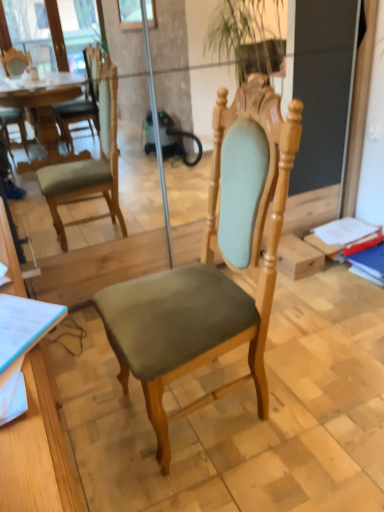
I want to click on wooden desk at lower left, so click(36, 451).

What do you see at coordinates (36, 451) in the screenshot?
I see `wooden desk at lower left` at bounding box center [36, 451].

Describe the element at coordinates (212, 265) in the screenshot. The width and height of the screenshot is (384, 512). I see `matte green fabric chair at center` at that location.

Locate an element on the screen. matte green fabric chair at center is located at coordinates (212, 265).

Identify the location of wooden desk at lower left. This screenshot has height=512, width=384. (x=36, y=451).

Would you say wooden desk at lower left is to the left or to the right of matte green fabric chair at center in the picture?

Based on their positions, wooden desk at lower left is located to the left of matte green fabric chair at center.

Looking at this image, is wooden desk at lower left positioned before matte green fabric chair at center?

Yes, wooden desk at lower left is closer to the camera.

Does point (58, 450) come in front of point (250, 373)?

Yes, point (58, 450) is closer to viewer.

Looking at this image, from the image's perspective, between wooden desk at lower left and matte green fabric chair at center, which one is located above?

matte green fabric chair at center.

From a real-world perspective, is wooden desk at lower left over matte green fabric chair at center?

No.

Is wooden desk at lower left thinner than matte green fabric chair at center?

Yes, wooden desk at lower left is thinner than matte green fabric chair at center.

Considering the relative sizes of wooden desk at lower left and matte green fabric chair at center in the image provided, is wooden desk at lower left shorter than matte green fabric chair at center?

Correct, wooden desk at lower left is not as tall as matte green fabric chair at center.

Does wooden desk at lower left have a smaller size compared to matte green fabric chair at center?

Indeed, wooden desk at lower left has a smaller size compared to matte green fabric chair at center.

Is matte green fabric chair at center surrounded by wooden desk at lower left?

No, matte green fabric chair at center is located outside of wooden desk at lower left.

Is wooden desk at lower left not close to matte green fabric chair at center?

That's not correct — wooden desk at lower left is a little close to matte green fabric chair at center.

Based on the photo, does wooden desk at lower left turn towards matte green fabric chair at center?

Yes, wooden desk at lower left is aimed at matte green fabric chair at center.

How many degrees apart are the facing directions of wooden desk at lower left and matte green fabric chair at center?

The facing directions of wooden desk at lower left and matte green fabric chair at center are 177 degrees apart.

How much distance is there between wooden desk at lower left and matte green fabric chair at center?

wooden desk at lower left is 26.85 inches away from matte green fabric chair at center.

Where is `desk below the matte green fabric chair at center (from the image's perspective)`? This screenshot has width=384, height=512. desk below the matte green fabric chair at center (from the image's perspective) is located at coordinates (36, 451).

Considering the relative positions of matte green fabric chair at center and wooden desk at lower left in the image provided, is matte green fabric chair at center to the right of wooden desk at lower left from the viewer's perspective?

Yes, matte green fabric chair at center is to the right of wooden desk at lower left.

Is matte green fabric chair at center positioned in front of wooden desk at lower left?

No, matte green fabric chair at center is behind wooden desk at lower left.

Does point (222, 100) come behind point (37, 357)?

Yes, point (222, 100) is behind point (37, 357).

From the image's perspective, is matte green fabric chair at center located beneath wooden desk at lower left?

No, from the image's perspective, matte green fabric chair at center is not beneath wooden desk at lower left.

From a real-world perspective, which object stands above the other?

From a 3D spatial view, matte green fabric chair at center is above.

Which object is wider, matte green fabric chair at center or wooden desk at lower left?

With larger width is matte green fabric chair at center.

In terms of height, does matte green fabric chair at center look taller or shorter compared to wooden desk at lower left?

Considering their sizes, matte green fabric chair at center has more height than wooden desk at lower left.

Is matte green fabric chair at center smaller than wooden desk at lower left?

Actually, matte green fabric chair at center might be larger than wooden desk at lower left.

Looking at this image, can wooden desk at lower left be found inside matte green fabric chair at center?

That's incorrect, wooden desk at lower left is not inside matte green fabric chair at center.

Is matte green fabric chair at center in contact with wooden desk at lower left?

matte green fabric chair at center and wooden desk at lower left are clearly separated.

Is matte green fabric chair at center facing towards wooden desk at lower left?

Yes, matte green fabric chair at center faces towards wooden desk at lower left.

Measure the distance from matte green fabric chair at center to wooden desk at lower left.

matte green fabric chair at center and wooden desk at lower left are 26.85 inches apart.

What are the coordinates of `desk directly beneath the matte green fabric chair at center (from a real-world perspective)` in the screenshot? It's located at (36, 451).

You are a GUI agent. You are given a task and a screenshot of the screen. Output one action in this format:
    pyautogui.click(x=<x>, y=<y>)
    Task: Click on the desk in front of the matte green fabric chair at center
    
    Given the screenshot: What is the action you would take?
    pyautogui.click(x=36, y=451)

I want to click on desk below the matte green fabric chair at center (from the image's perspective), so click(x=36, y=451).